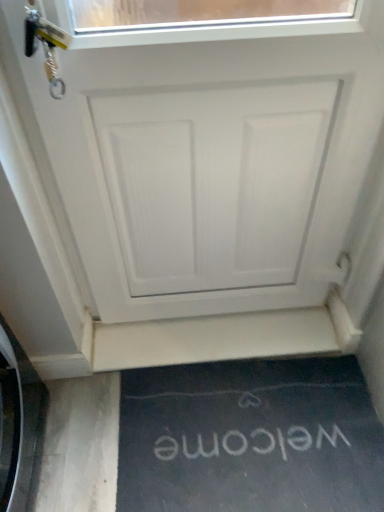
Question: Can you confirm if white matte door at center is smaller than black rubber doormat at lower center?

Choices:
 (A) no
 (B) yes

Answer: (A)

Question: From the image's perspective, does white matte door at center appear higher than black rubber doormat at lower center?

Choices:
 (A) yes
 (B) no

Answer: (A)

Question: Is black rubber doormat at lower center at the back of white matte door at center?

Choices:
 (A) no
 (B) yes

Answer: (A)

Question: Is white matte door at center taller than black rubber doormat at lower center?

Choices:
 (A) no
 (B) yes

Answer: (B)

Question: Is white matte door at center positioned behind black rubber doormat at lower center?

Choices:
 (A) no
 (B) yes

Answer: (A)

Question: Is white matte door at center wider or thinner than black rubber doormat at lower center?

Choices:
 (A) thin
 (B) wide

Answer: (A)

Question: Is white matte door at center taller or shorter than black rubber doormat at lower center?

Choices:
 (A) tall
 (B) short

Answer: (A)

Question: From a real-world perspective, is white matte door at center above or below black rubber doormat at lower center?

Choices:
 (A) above
 (B) below

Answer: (A)

Question: From the image's perspective, is white matte door at center positioned above or below black rubber doormat at lower center?

Choices:
 (A) above
 (B) below

Answer: (A)

Question: Is point (205, 349) closer or farther from the camera than point (215, 421)?

Choices:
 (A) farther
 (B) closer

Answer: (A)

Question: In the image, is white matte stairwell at lower center positioned in front of or behind black rubber doormat at lower center?

Choices:
 (A) behind
 (B) front

Answer: (A)

Question: Would you say white matte stairwell at lower center is inside or outside black rubber doormat at lower center?

Choices:
 (A) inside
 (B) outside

Answer: (B)

Question: Considering the positions of white matte stairwell at lower center and black rubber doormat at lower center in the image, is white matte stairwell at lower center wider or thinner than black rubber doormat at lower center?

Choices:
 (A) thin
 (B) wide

Answer: (A)

Question: Considering their positions, is black rubber doormat at lower center located in front of or behind white matte door at center?

Choices:
 (A) behind
 (B) front

Answer: (A)

Question: In the image, is black rubber doormat at lower center on the left side or the right side of white matte door at center?

Choices:
 (A) left
 (B) right

Answer: (B)